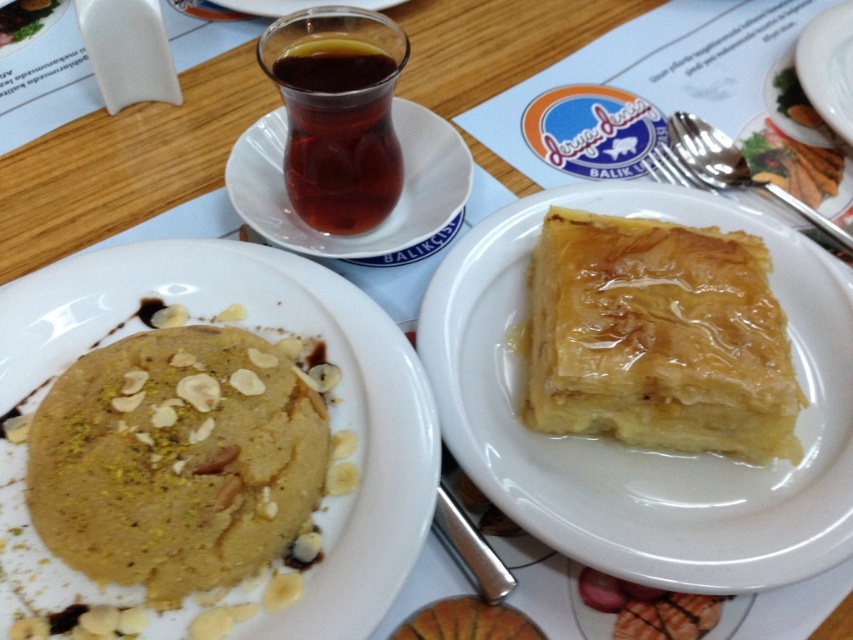
Can you confirm if smooth brown pancake at center is wider than white glossy plate at upper center?

Indeed, smooth brown pancake at center has a greater width compared to white glossy plate at upper center.

Between smooth brown pancake at center and white glossy plate at upper center, which one has less height?

white glossy plate at upper center

Who is more forward, (412, 355) or (822, 70)?

Point (412, 355) is more forward.

Locate an element on the screen. Image resolution: width=853 pixels, height=640 pixels. smooth brown pancake at center is located at coordinates (329, 404).

Is smooth brown pancake at center shorter than golden flaky pastry at right?

In fact, smooth brown pancake at center may be taller than golden flaky pastry at right.

Who is shorter, smooth brown pancake at center or golden flaky pastry at right?

With less height is golden flaky pastry at right.

Locate an element on the screen. smooth brown pancake at center is located at coordinates (329, 404).

This screenshot has width=853, height=640. What are the coordinates of `smooth brown pancake at center` in the screenshot? It's located at (329, 404).

Which of these two, smooth brown pancake at center or brown glass cup at upper center, stands shorter?

With less height is brown glass cup at upper center.

Between smooth brown pancake at center and brown glass cup at upper center, which one is positioned lower?

smooth brown pancake at center is lower down.

Is point (374, 536) positioned in front of point (340, 145)?

That is True.

You are a GUI agent. You are given a task and a screenshot of the screen. Output one action in this format:
    pyautogui.click(x=<x>, y=<y>)
    Task: Click on the smooth brown pancake at center
    The width and height of the screenshot is (853, 640).
    Given the screenshot: What is the action you would take?
    pyautogui.click(x=329, y=404)